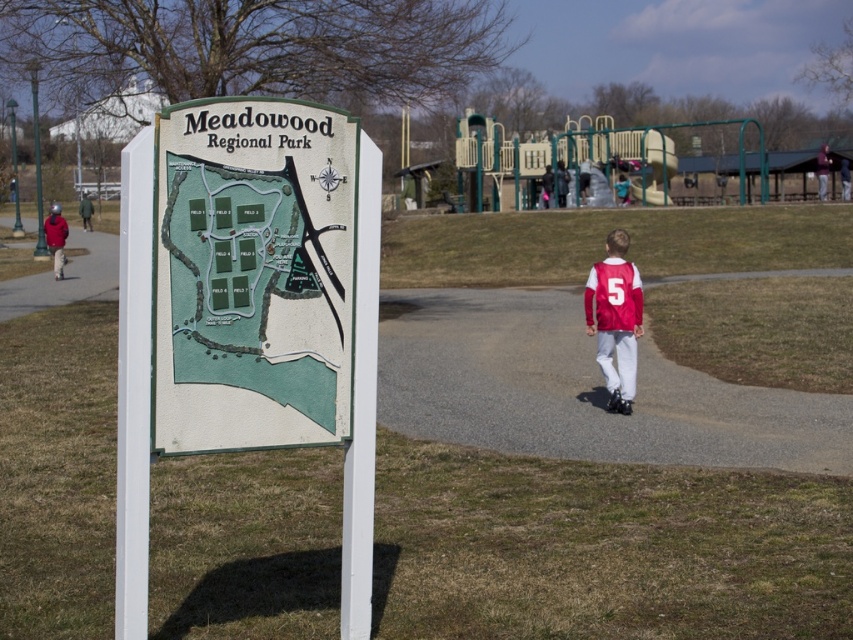
Question: Is gray asphalt path at center closer to the viewer compared to green matte map at center?

Choices:
 (A) yes
 (B) no

Answer: (B)

Question: Can you confirm if green plastic sign at center is smaller than gray asphalt path at center?

Choices:
 (A) no
 (B) yes

Answer: (B)

Question: Which object is closer to the camera taking this photo?

Choices:
 (A) green plastic sign at center
 (B) gray asphalt path at center
 (C) smooth asphalt path at left

Answer: (A)

Question: Can you confirm if green plastic sign at center is positioned below matte red jersey at center?

Choices:
 (A) yes
 (B) no

Answer: (B)

Question: Which of these objects is positioned closest to the matte red jersey at center?

Choices:
 (A) green plastic sign at center
 (B) green matte map at center
 (C) gray asphalt path at center

Answer: (C)

Question: Which object appears farthest from the camera in this image?

Choices:
 (A) green plastic sign at center
 (B) green matte map at center

Answer: (B)